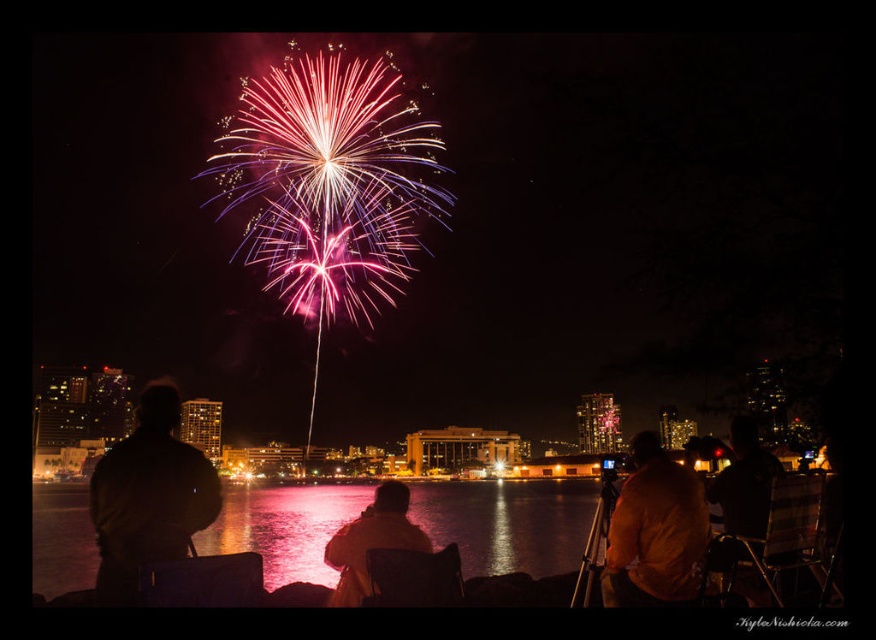
You are a photographer trying to capture the reflection of the fireworks in the glossy reflective water at center. Based on the coordinates provided, where should you position your camera to ensure the reflection is centered in your shot?

The glossy reflective water at center is located at coordinates point (507, 522), so you should position your camera directly above or aligned with this point to capture the reflection centered in your shot.

You are standing in the city watching the fireworks. There are two points in the image, point 1 at coordinates point [651,483] and point 2 at coordinates point [401,488]. Which point is closer to you?

Point [651,483] is closer to the viewer than point [401,488].

You are standing at the fireworks display and want to take a photo of both the point at coordinates point (x=253, y=493) and the point at coordinates point (x=629, y=561). Which point will appear closer to the camera in your photo?

Point (x=253, y=493) is further to the camera than point (x=629, y=561), so in the photo, point (x=253, y=493) will appear closer to the camera than point (x=629, y=561).